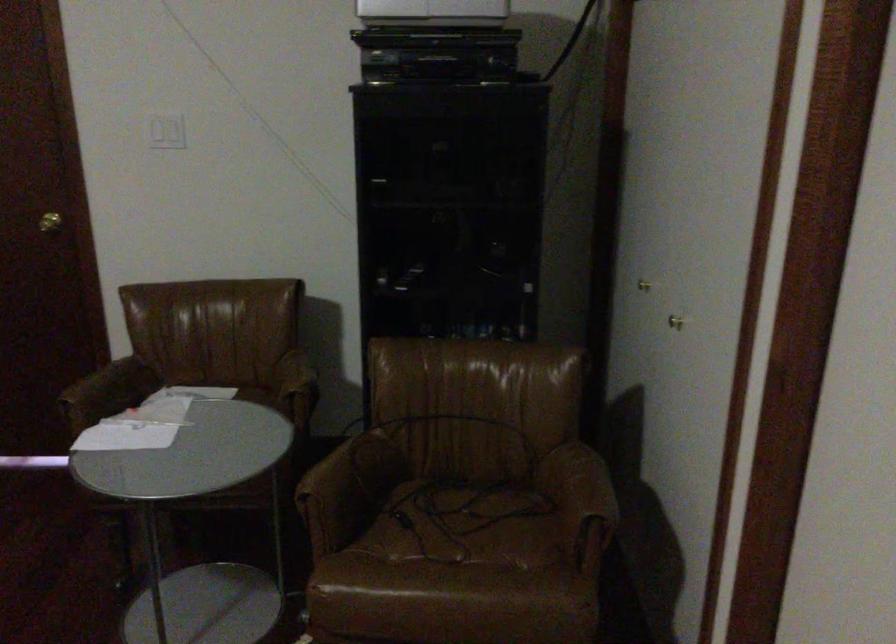
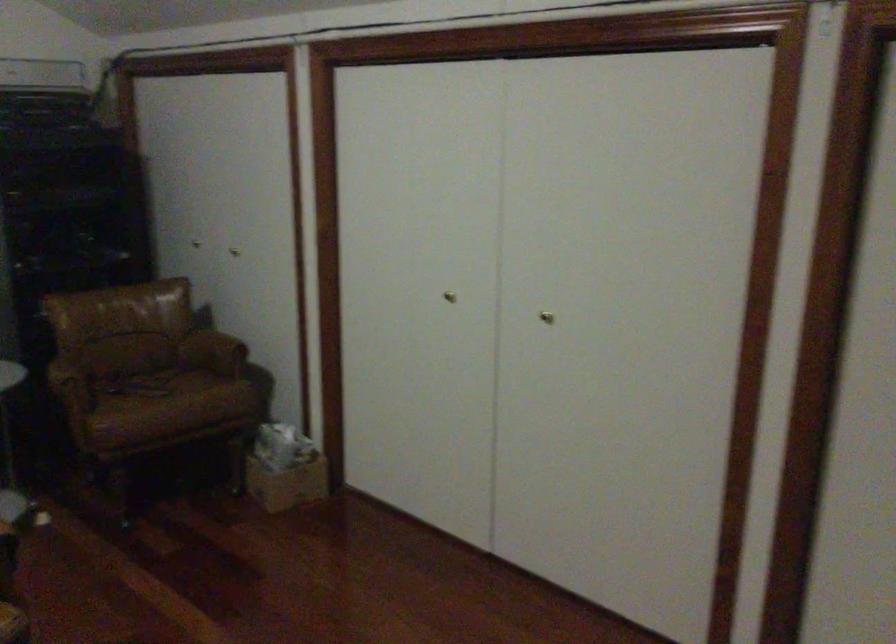
Where in the second image is the point corresponding to point (485, 491) from the first image?

(149, 370)